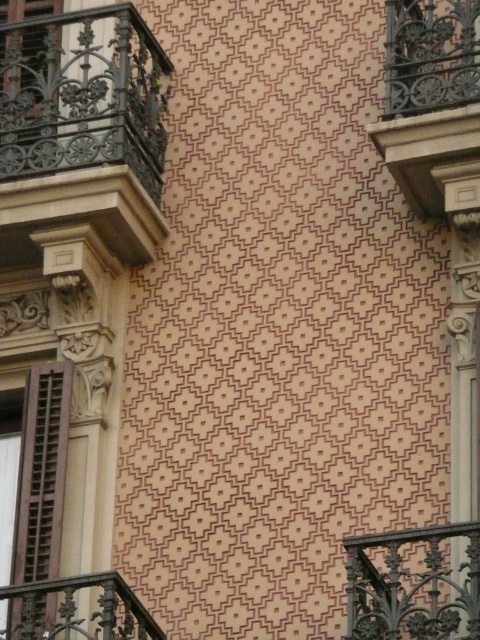
Question: Does dark brown wrought iron at lower right come in front of brown wooden shutter at left?

Choices:
 (A) no
 (B) yes

Answer: (B)

Question: Which point is farther to the camera?

Choices:
 (A) (13, 544)
 (B) (25, 614)
 (C) (354, 600)

Answer: (A)

Question: Among these points, which one is nearest to the camera?

Choices:
 (A) (408, 538)
 (B) (54, 77)
 (C) (432, 188)
 (D) (49, 385)

Answer: (A)

Question: Observing the image, what is the correct spatial positioning of dark brown wrought iron balcony at upper right in reference to brown wooden shutter at left?

Choices:
 (A) right
 (B) left

Answer: (A)

Question: Which is farther from the dark brown wrought iron at lower left?

Choices:
 (A) brown wooden shutter at left
 (B) dark brown wrought iron balcony at upper left
 (C) dark brown wrought iron balcony at upper right
 (D) dark brown wrought iron at lower right

Answer: (B)

Question: Is dark brown wrought iron at lower right positioned at the back of dark brown wrought iron at lower left?

Choices:
 (A) no
 (B) yes

Answer: (A)